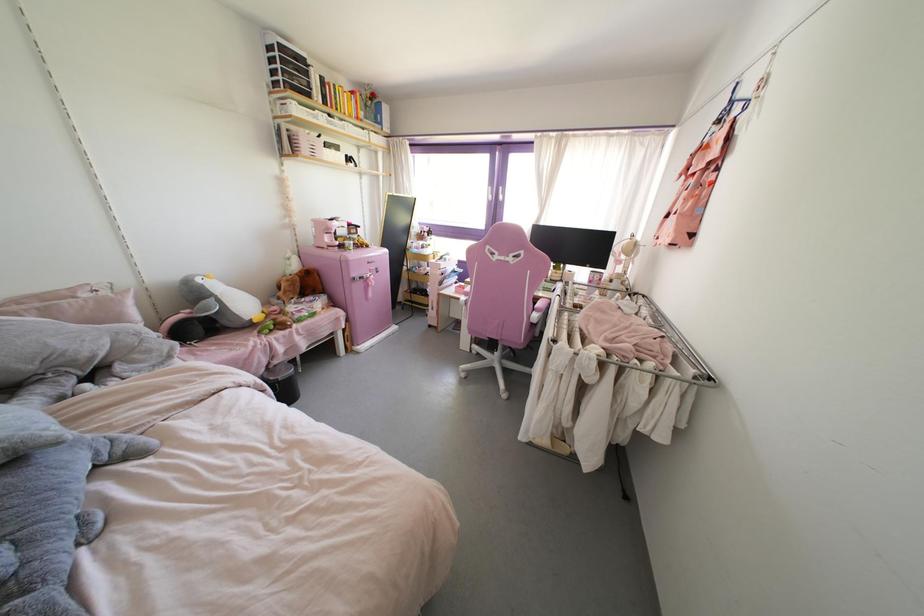
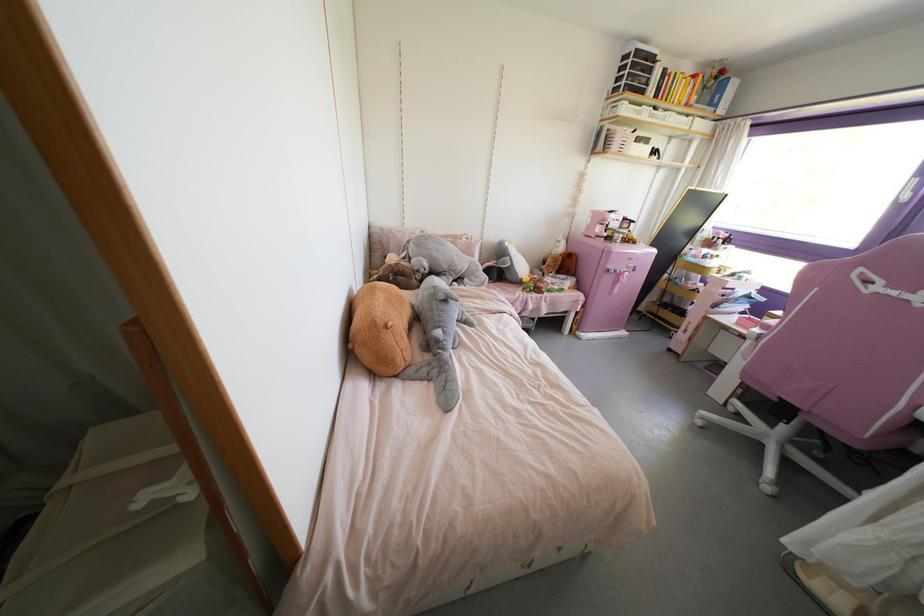
The point at [254,320] is marked in the first image. Where is the corresponding point in the second image?

(523, 280)